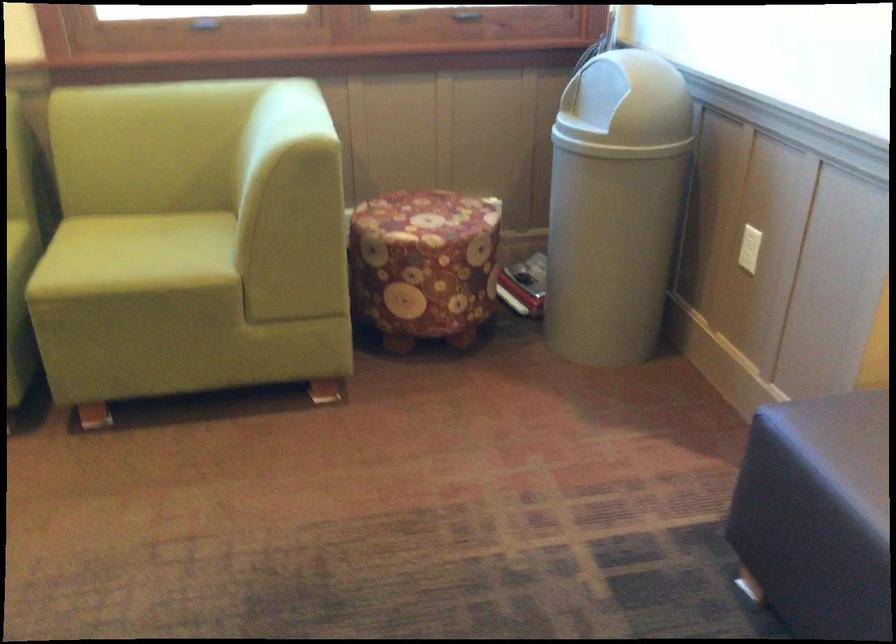
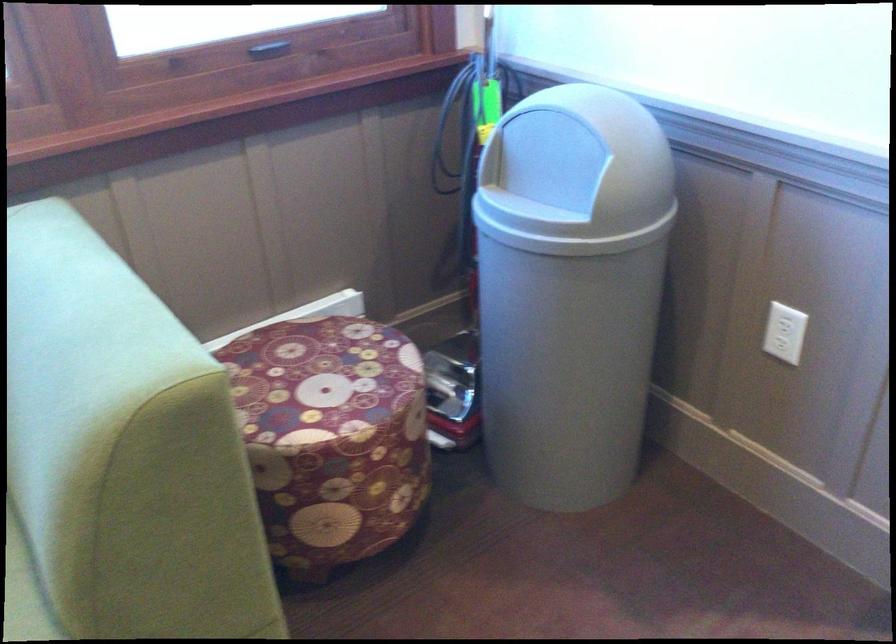
Locate, in the second image, the point that corresponds to (600,102) in the first image.

(550, 174)